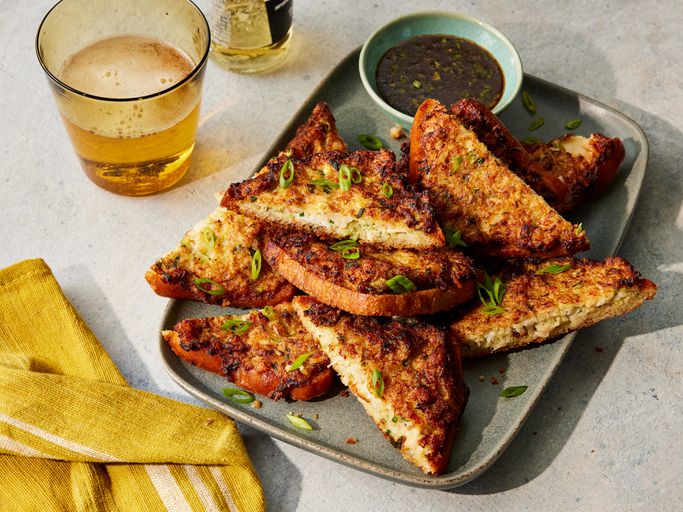
The height and width of the screenshot is (512, 683). Identify the location of napkin. (46, 322).